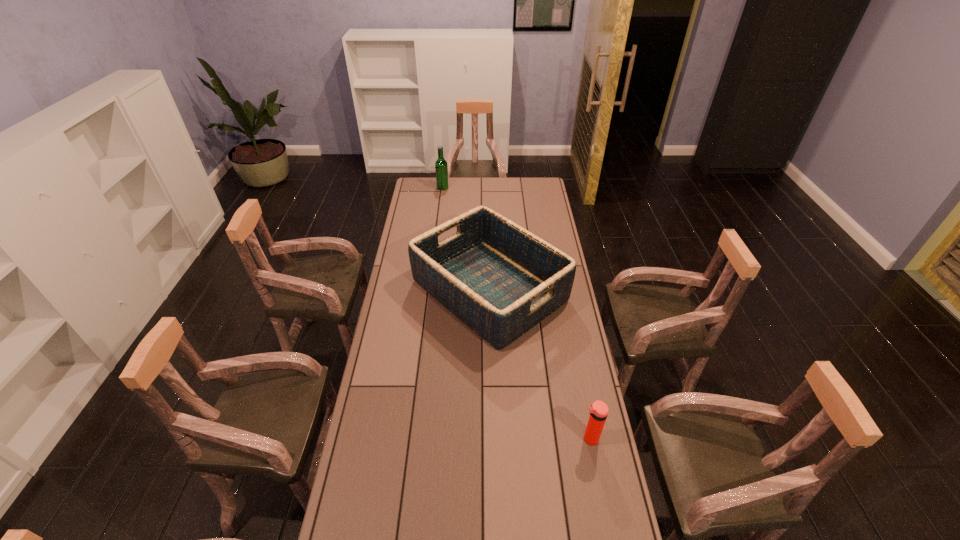
At what (x,y) coordinates should I click in order to perform the action: click on beer bottle. Please return your answer as a coordinate pair (x, y). Looking at the image, I should click on (441, 168).

This screenshot has width=960, height=540. I want to click on the second farthest object, so click(499, 279).

The image size is (960, 540). I want to click on thermos bottle, so click(x=598, y=411).

Locate an element on the screen. The height and width of the screenshot is (540, 960). the nearest object is located at coordinates (598, 411).

The height and width of the screenshot is (540, 960). In order to click on free space located 0.250m on the right of the farthest object in this screenshot , I will do `click(491, 188)`.

Locate an element on the screen. vacant space located 0.260m on the back of the second nearest object is located at coordinates (488, 214).

Identify the location of vacant space located 0.330m on the left of the thermos bottle. The height and width of the screenshot is (540, 960). (482, 438).

Find the location of a particular element. The image size is (960, 540). object present at the far edge is located at coordinates (441, 168).

You are a GUI agent. You are given a task and a screenshot of the screen. Output one action in this format:
    pyautogui.click(x=<x>, y=<y>)
    Task: Click on the beer bottle at the left edge
    The width and height of the screenshot is (960, 540).
    Given the screenshot: What is the action you would take?
    pyautogui.click(x=441, y=168)

In order to click on basket located in the left edge section of the desktop in this screenshot , I will do `click(499, 279)`.